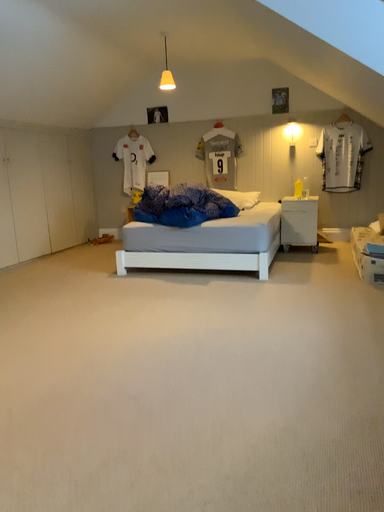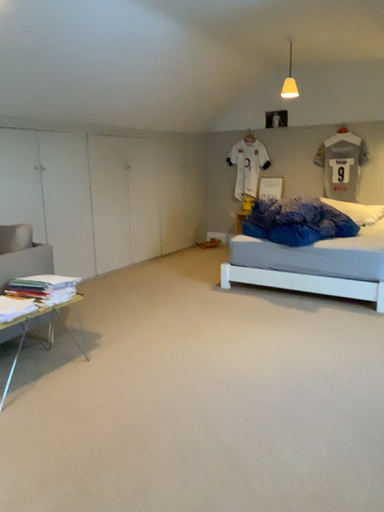
Question: How did the camera likely rotate when shooting the video?

Choices:
 (A) rotated left
 (B) rotated right

Answer: (A)